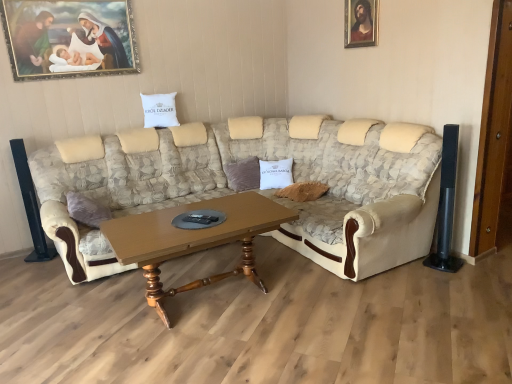
Find the location of a particular element. The width and height of the screenshot is (512, 384). free spot in front of brown wooden coffee table at center is located at coordinates (222, 356).